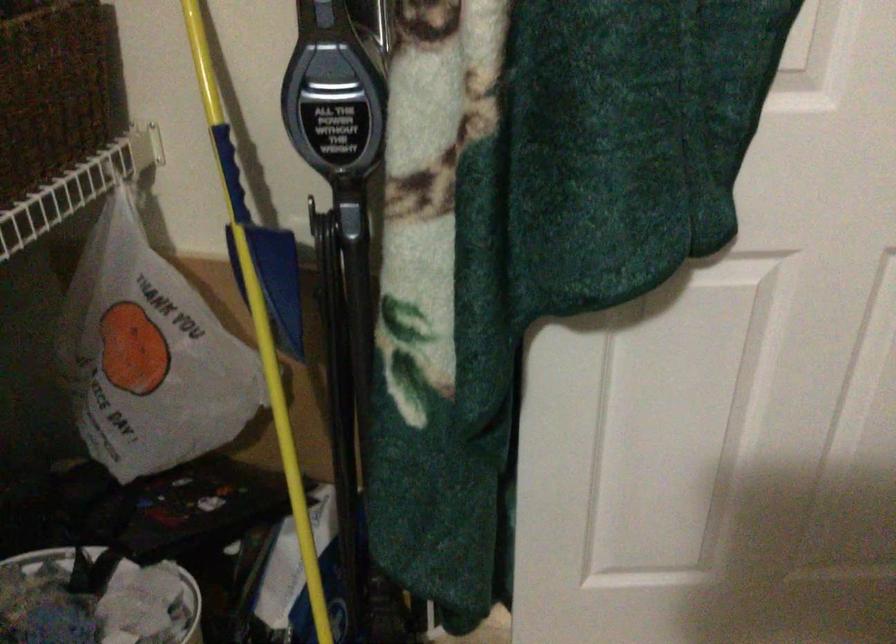
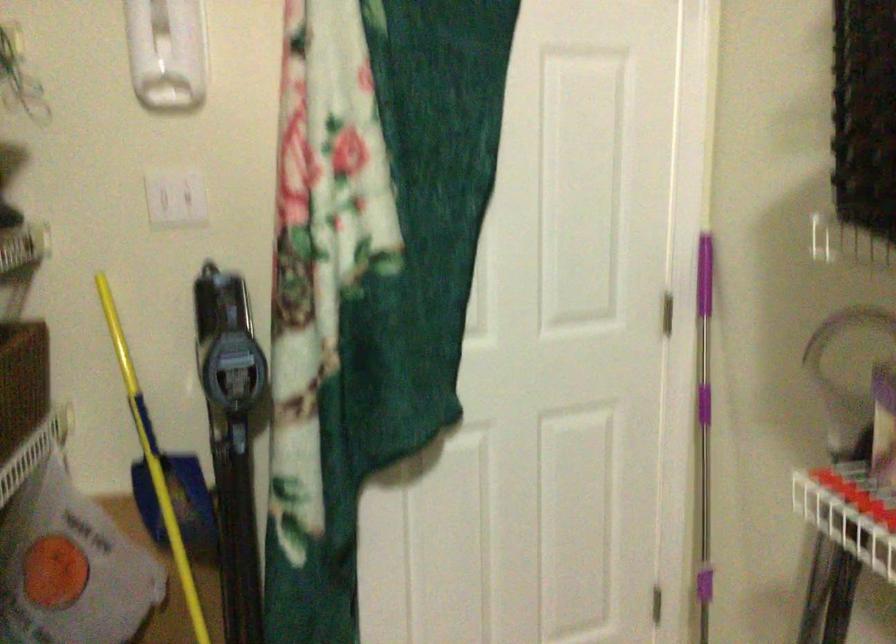
Looking at this image, how did the camera likely rotate?

The rotation direction of the camera is right-up.